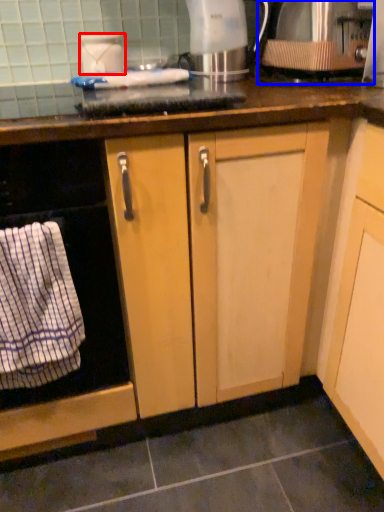
Question: Which object is further to the camera taking this photo, kitchen appliance (highlighted by a red box) or kitchen appliance (highlighted by a blue box)?

Choices:
 (A) kitchen appliance
 (B) kitchen appliance

Answer: (A)